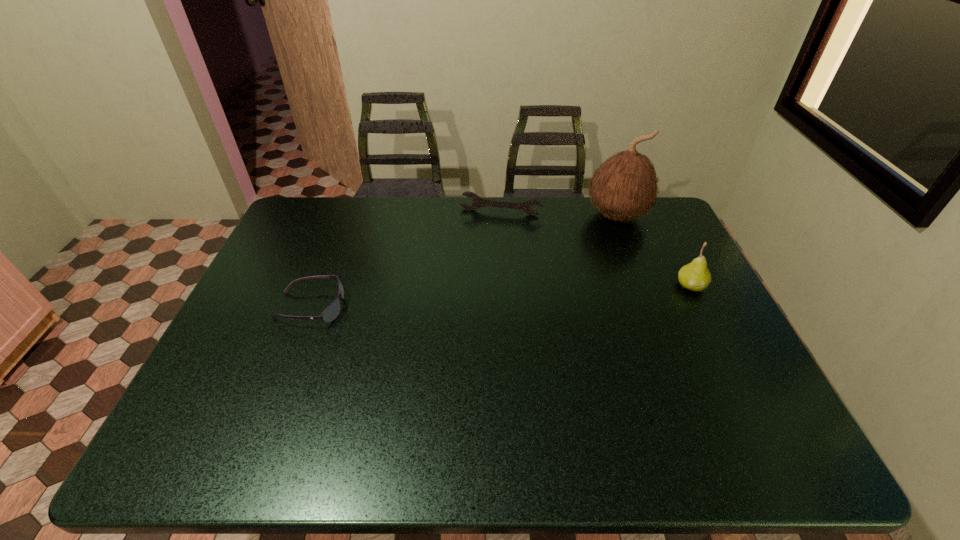
Where is `sunglasses`? The image size is (960, 540). sunglasses is located at coordinates (332, 311).

Where is `the shortest object`? The image size is (960, 540). the shortest object is located at coordinates (x=332, y=311).

Find the location of a particular element. pear is located at coordinates (695, 276).

Identify the location of the second object from left to right. This screenshot has width=960, height=540. (478, 202).

This screenshot has height=540, width=960. What are the coordinates of `the second shortest object` in the screenshot? It's located at (478, 202).

Find the location of a particular element. The width and height of the screenshot is (960, 540). the tallest object is located at coordinates (625, 186).

This screenshot has width=960, height=540. In order to click on vacant region located 0.360m on the lenses of the shortest object in this screenshot , I will do `click(473, 307)`.

Image resolution: width=960 pixels, height=540 pixels. Identify the location of free location located 0.050m on the left of the second tallest object. (659, 286).

Locate an element on the screen. The height and width of the screenshot is (540, 960). vacant area situated 0.190m on the open ends of the second object from left to right is located at coordinates (486, 251).

Where is `free space located 0.360m on the open ends of the second object from left to right`? This screenshot has height=540, width=960. free space located 0.360m on the open ends of the second object from left to right is located at coordinates (477, 288).